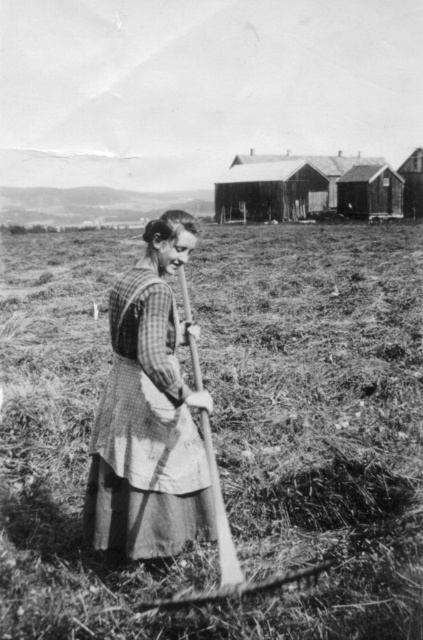
You are a traveler who wants to find the taller wooden hut. You see the wooden hut at center and the wooden hut at upper right. Which one should you go to?

The wooden hut at upper right is taller than the wooden hut at center, so you should go to the wooden hut at upper right.